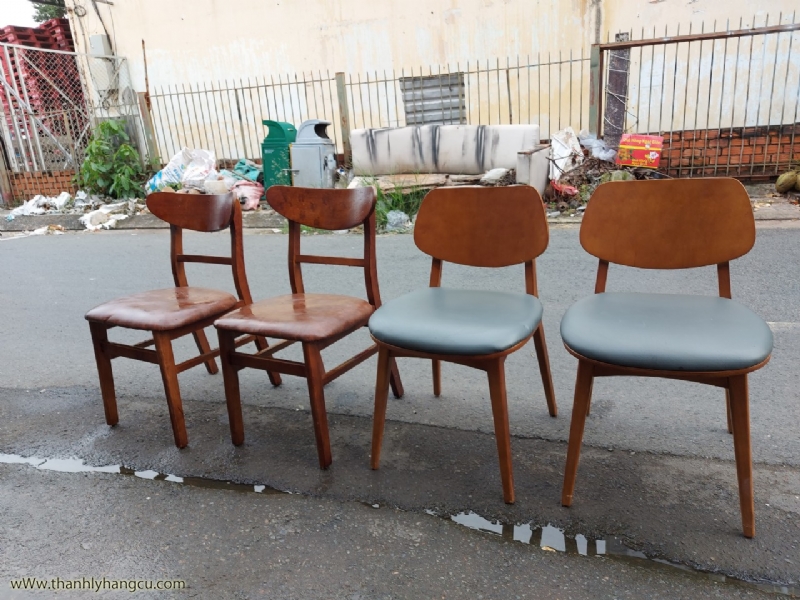
Locate an element on the screen. Image resolution: width=800 pixels, height=600 pixels. seats of the chairs is located at coordinates (188, 309), (312, 312), (478, 312), (688, 322).